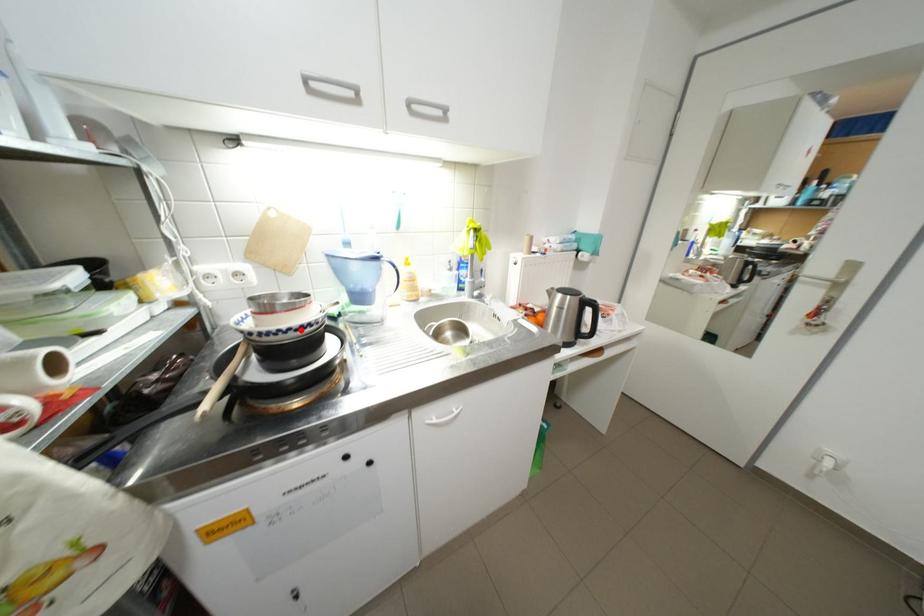
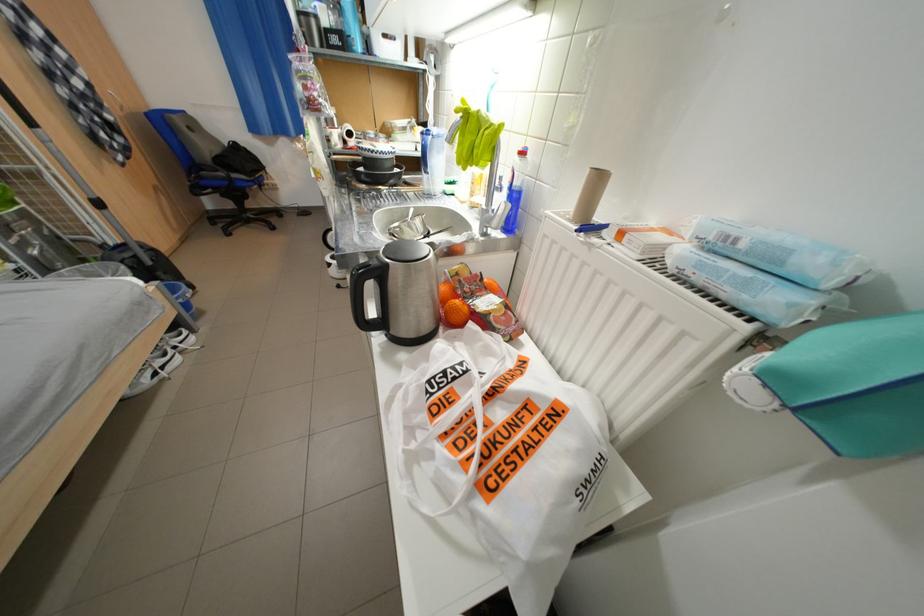
Question: I am providing you with two images of the same scene from different viewpoints. A red point is marked on the first image. Can you still see the location of the red point in image 2?

Choices:
 (A) Yes
 (B) No

Answer: (B)